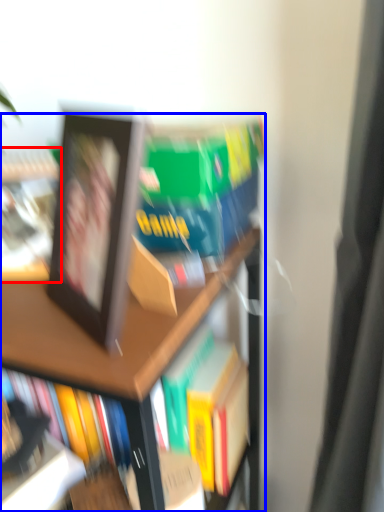
Question: Among these objects, which one is nearest to the camera, book (highlighted by a red box) or bookcase (highlighted by a blue box)?

Choices:
 (A) book
 (B) bookcase

Answer: (B)